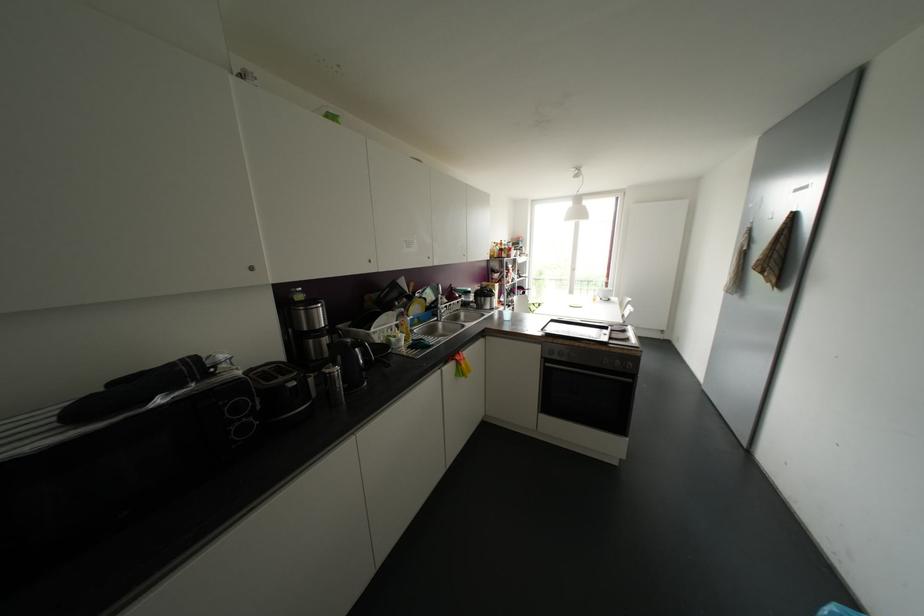
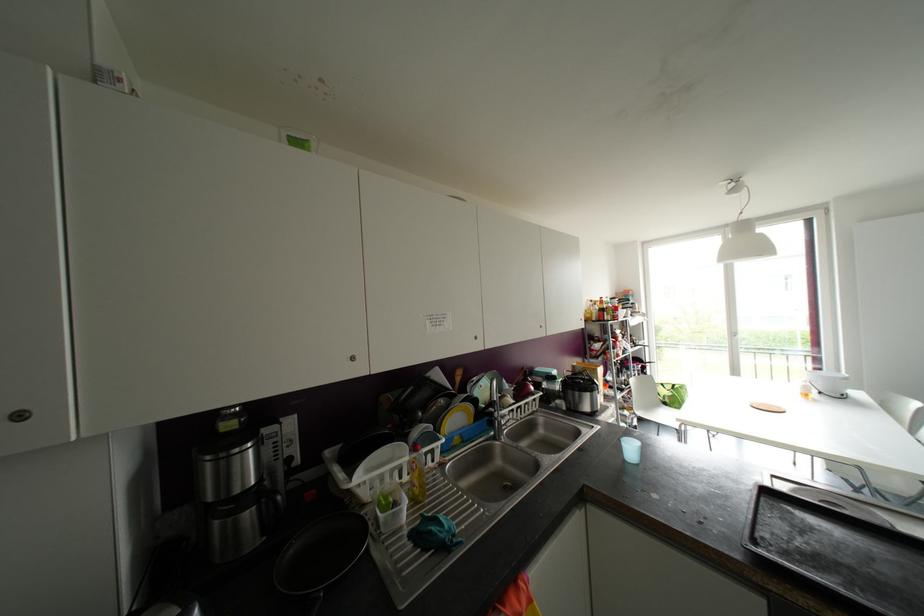
Locate, in the second image, the point that corresponds to (x=370, y=261) in the first image.

(351, 358)